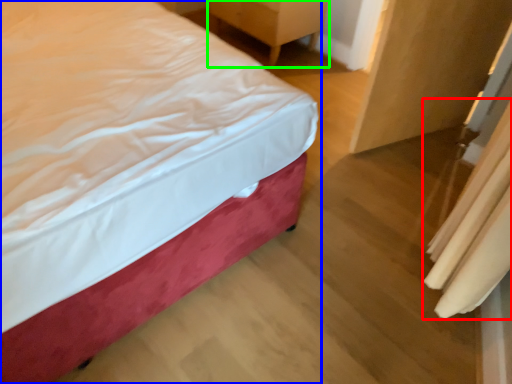
Question: Estimate the real-world distances between objects in this image. Which object is farther from curtain (highlighted by a red box), bed (highlighted by a blue box) or furniture (highlighted by a green box)?

Choices:
 (A) bed
 (B) furniture

Answer: (B)